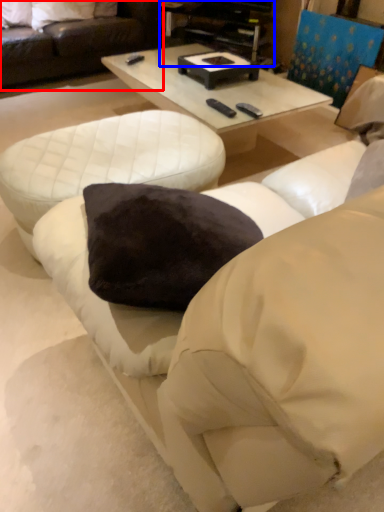
Question: Which point is further to the camera, studio couch (highlighted by a red box) or entertainment center (highlighted by a blue box)?

Choices:
 (A) studio couch
 (B) entertainment center

Answer: (B)